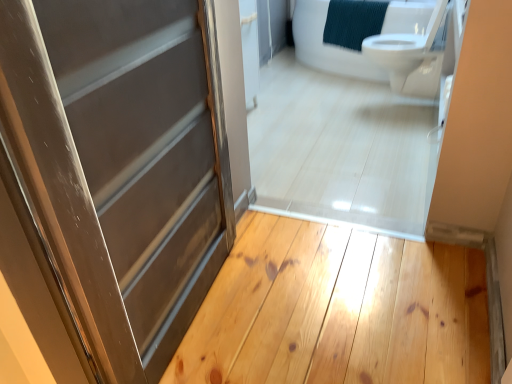
Question: In the image, is white glossy toilet at upper right positioned in front of or behind light brown wood plank at center?

Choices:
 (A) behind
 (B) front

Answer: (A)

Question: Is white glossy toilet at upper right spatially inside light brown wood plank at center, or outside of it?

Choices:
 (A) inside
 (B) outside

Answer: (B)

Question: Estimate the real-world distances between objects in this image. Which object is closer to the white glossy toilet at upper right?

Choices:
 (A) light brown wood plank at center
 (B) matte gray door at center

Answer: (A)

Question: Estimate the real-world distances between objects in this image. Which object is farther from the matte gray door at center?

Choices:
 (A) white glossy toilet at upper right
 (B) light brown wood plank at center

Answer: (A)